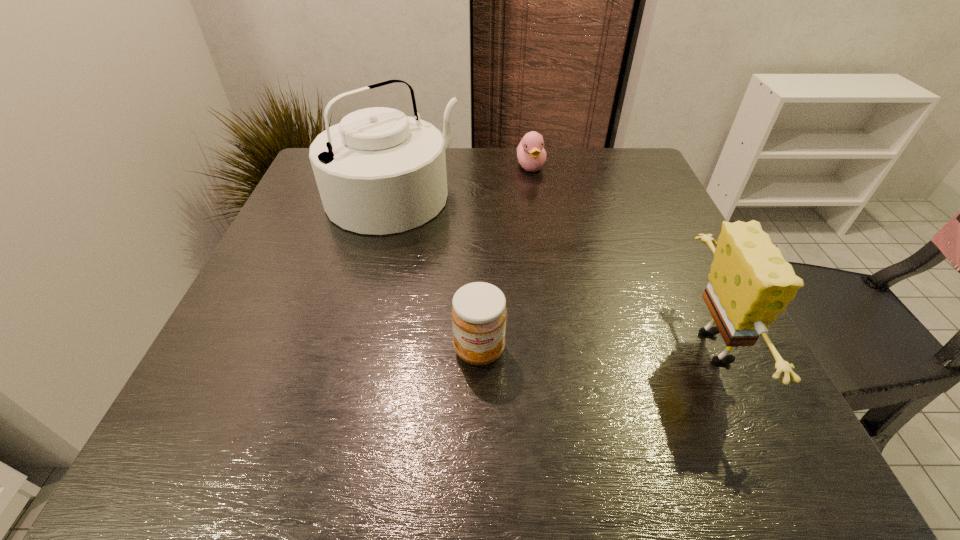
You are a GUI agent. You are given a task and a screenshot of the screen. Output one action in this format:
    pyautogui.click(x=<x>, y=<y>)
    Task: Click on the vacant region between the kettle and the duckling
    This screenshot has width=960, height=540.
    Given the screenshot: What is the action you would take?
    pyautogui.click(x=462, y=183)

Where is `vacant space that is in between the sponge and the second object from right to left`? This screenshot has width=960, height=540. vacant space that is in between the sponge and the second object from right to left is located at coordinates tap(625, 257).

Where is `free spot between the second object from right to left and the leftmost object`? The width and height of the screenshot is (960, 540). free spot between the second object from right to left and the leftmost object is located at coordinates (462, 183).

I want to click on vacant area that lies between the tallest object and the second object from right to left, so click(x=462, y=183).

Locate an element on the screen. vacant space that is in between the leftmost object and the rightmost object is located at coordinates (556, 273).

Point out which object is positioned as the second nearest to the third object from right to left. Please provide its 2D coordinates. Your answer should be formatted as a tuple, i.e. [(x, y)], where the tuple contains the x and y coordinates of a point satisfying the conditions above.

[(750, 283)]

Choose which object is the third nearest neighbor to the rightmost object. Please provide its 2D coordinates. Your answer should be formatted as a tuple, i.e. [(x, y)], where the tuple contains the x and y coordinates of a point satisfying the conditions above.

[(378, 171)]

Image resolution: width=960 pixels, height=540 pixels. Find the location of `blank area in the image that satisfies the following two spatial constraints: 1. on the front side of the rightmost object; 2. on the face of the duckling`. blank area in the image that satisfies the following two spatial constraints: 1. on the front side of the rightmost object; 2. on the face of the duckling is located at coordinates [x=560, y=347].

This screenshot has width=960, height=540. Identify the location of vacant space that satisfies the following two spatial constraints: 1. on the back side of the duckling; 2. on the right side of the kettle. (400, 167).